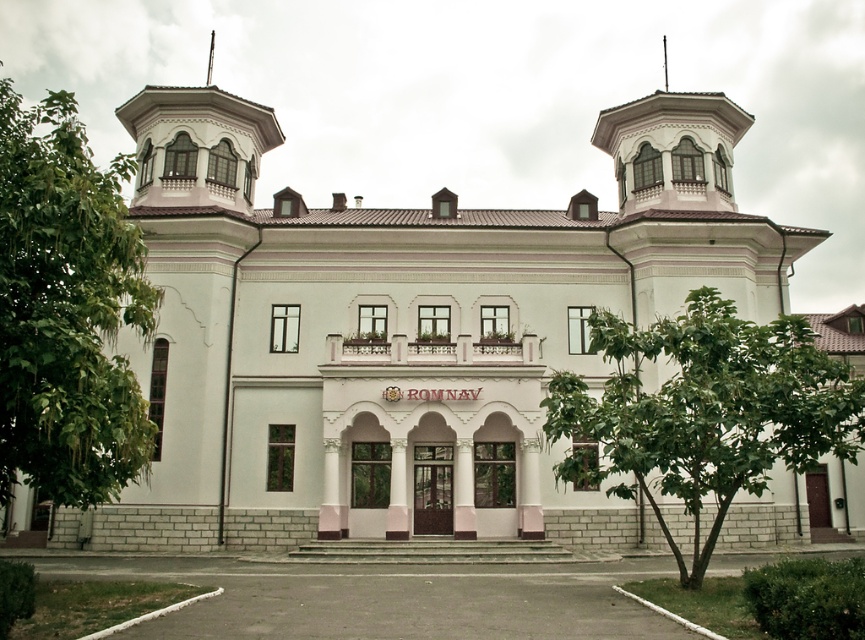
Is green leafy tree at left above green leafy tree at center?

Yes, green leafy tree at left is above green leafy tree at center.

Does green leafy tree at left have a smaller size compared to green leafy tree at center?

Actually, green leafy tree at left might be larger than green leafy tree at center.

Does point (18, 440) lie behind point (811, 381)?

That is False.

Locate an element on the screen. The width and height of the screenshot is (865, 640). green leafy tree at left is located at coordinates (67, 310).